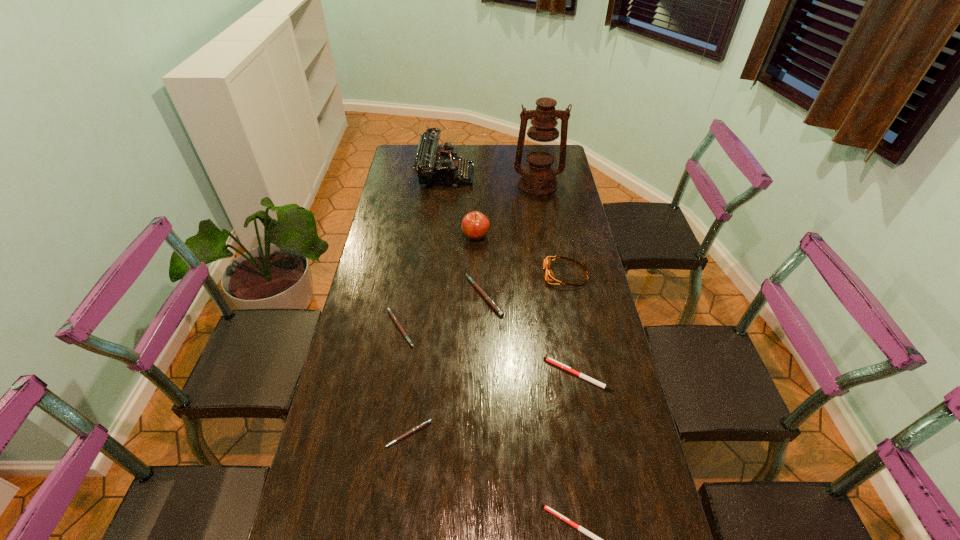
The image size is (960, 540). Identify the location of the nearest pink pen. (415, 429).

At what (x,y) coordinates should I click in order to perform the action: click on the smallest pink pen. Please return your answer as a coordinate pair (x, y). Looking at the image, I should click on (415, 429).

This screenshot has height=540, width=960. In order to click on vacant space located 0.290m on the left of the tallest object in this screenshot , I will do `click(449, 185)`.

The image size is (960, 540). Identify the location of free region located 0.270m on the keyboard of the typewriter. (532, 175).

At what (x,y) coordinates should I click in order to perform the action: click on vacant space located on the right of the third tallest object. Please return your answer as a coordinate pair (x, y). Looking at the image, I should click on [x=531, y=237].

At what (x,y) coordinates should I click in order to perform the action: click on vacant region located with the lenses facing forward on the sixth shortest object. Please return your answer as a coordinate pair (x, y). Looking at the image, I should click on (439, 275).

The height and width of the screenshot is (540, 960). I want to click on free spot located with the lenses facing forward on the sixth shortest object, so click(x=477, y=275).

Image resolution: width=960 pixels, height=540 pixels. I want to click on vacant region located 0.230m with the lenses facing forward on the sixth shortest object, so click(x=480, y=275).

The width and height of the screenshot is (960, 540). Find the location of `free space located 0.320m at the nib of the tallest pen`. free space located 0.320m at the nib of the tallest pen is located at coordinates (372, 296).

Where is `vacant area located at the nib of the tallest pen`? vacant area located at the nib of the tallest pen is located at coordinates (396, 296).